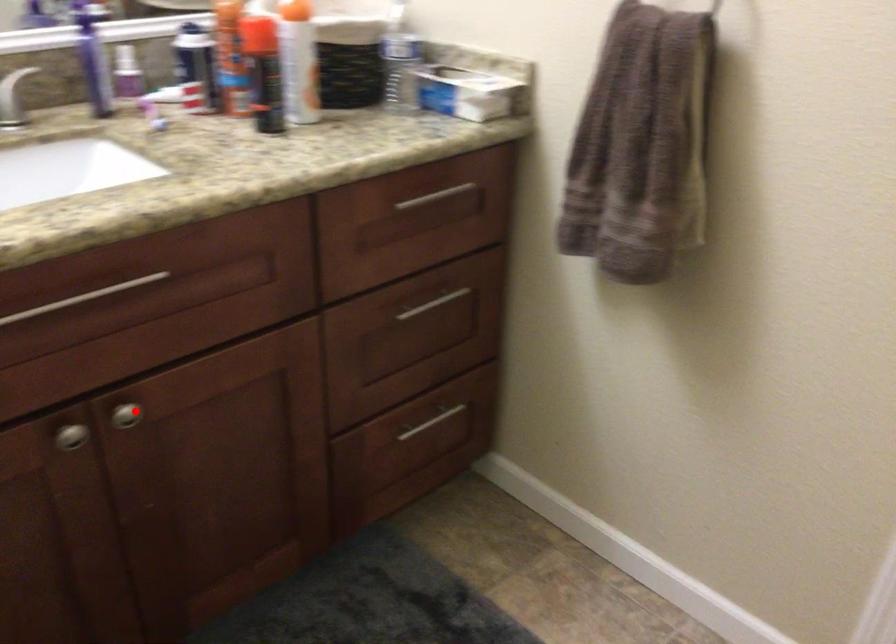
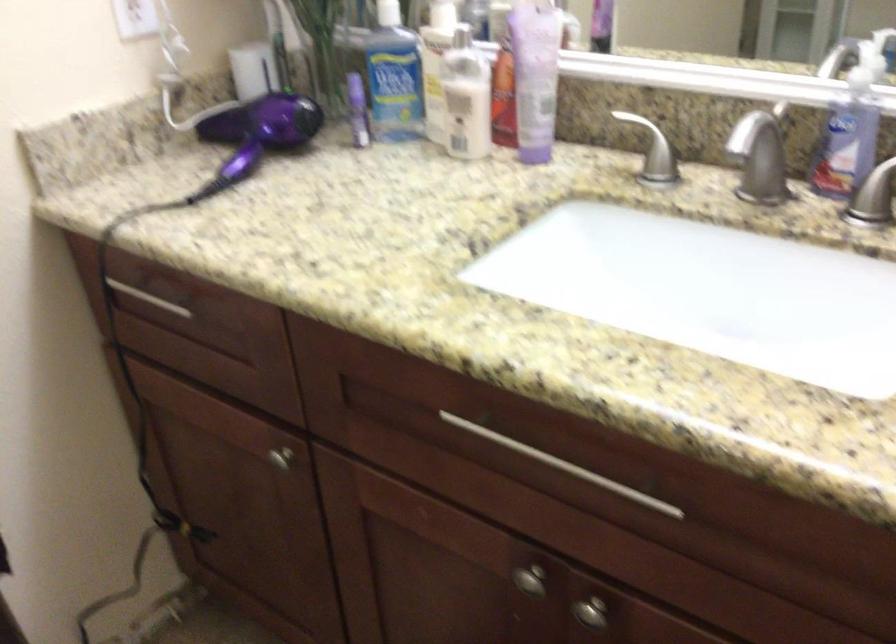
The point at the highlighted location is marked in the first image. Where is the corresponding point in the second image?

(590, 612)